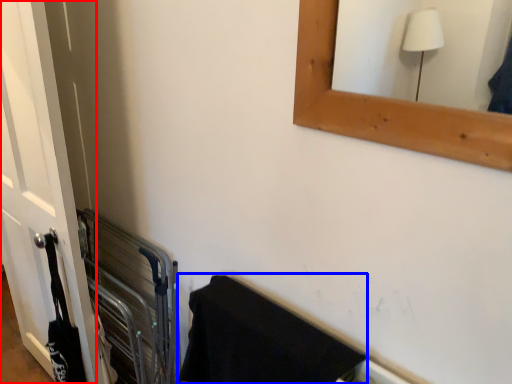
Question: Which of the following is the closest to the observer, door (highlighted by a red box) or bath towel (highlighted by a blue box)?

Choices:
 (A) door
 (B) bath towel

Answer: (B)